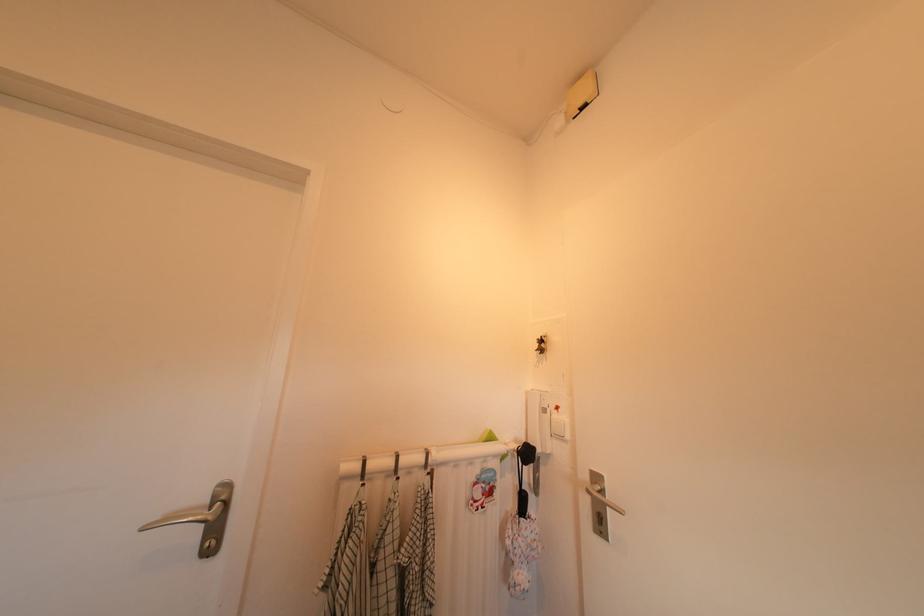
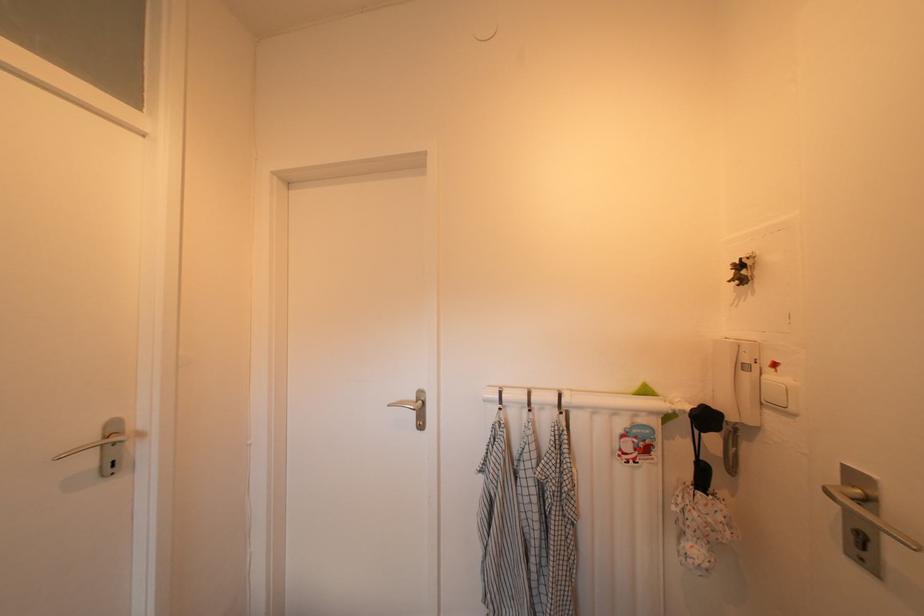
Question: Based on the continuous images, in which direction is the camera rotating? Reply with the corresponding letter.

Choices:
 (A) Left
 (B) Right
 (C) Up
 (D) Down

Answer: (A)